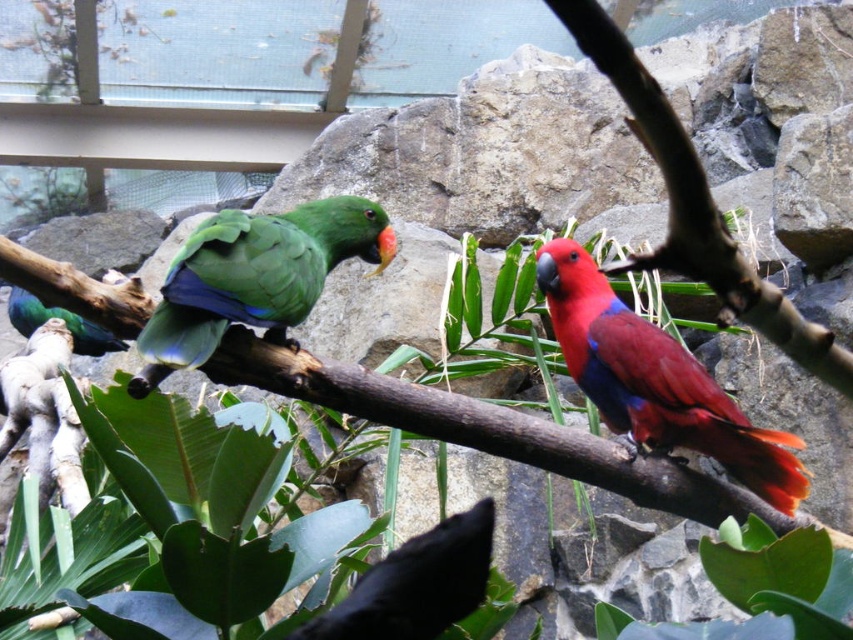
Between green matte branch at upper left and shiny crimson parrot at right, which one has less height?

Standing shorter between the two is green matte branch at upper left.

Locate an element on the screen. green matte branch at upper left is located at coordinates (486, 429).

Find the location of a particular element. The image size is (853, 640). green matte branch at upper left is located at coordinates (486, 429).

Is the position of green matte branch at upper left more distant than that of green glossy parrot at left?

No, it is in front of green glossy parrot at left.

Between green matte branch at upper left and green glossy parrot at left, which one is positioned lower?

green matte branch at upper left

Measure the distance between green matte branch at upper left and camera.

green matte branch at upper left and camera are 2.22 meters apart from each other.

Find the location of a particular element. The image size is (853, 640). green matte branch at upper left is located at coordinates (486, 429).

Is point (590, 292) farther from viewer compared to point (231, 212)?

That is True.

Identify the location of shiny crimson parrot at right. This screenshot has width=853, height=640. (656, 381).

At what (x,y) coordinates should I click in order to perform the action: click on shiny crimson parrot at right. Please return your answer as a coordinate pair (x, y). The image size is (853, 640). Looking at the image, I should click on (656, 381).